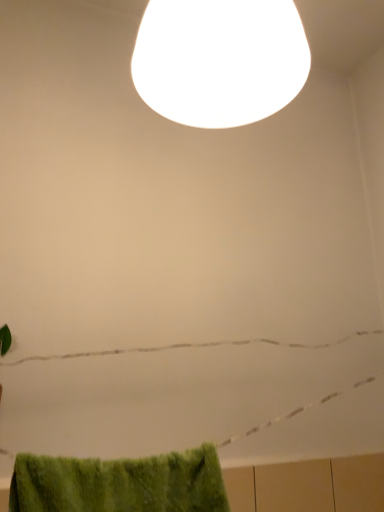
Question: Would you say green fuzzy bath towel at lower left is to the left or to the right of white glossy lampshade at upper center in the picture?

Choices:
 (A) right
 (B) left

Answer: (B)

Question: Is green fuzzy bath towel at lower left spatially inside white glossy lampshade at upper center, or outside of it?

Choices:
 (A) inside
 (B) outside

Answer: (B)

Question: From their relative heights in the image, would you say green fuzzy bath towel at lower left is taller or shorter than white glossy lampshade at upper center?

Choices:
 (A) tall
 (B) short

Answer: (B)

Question: Looking at their shapes, would you say white glossy lampshade at upper center is wider or thinner than green fuzzy bath towel at lower left?

Choices:
 (A) wide
 (B) thin

Answer: (A)

Question: In terms of height, does white glossy lampshade at upper center look taller or shorter compared to green fuzzy bath towel at lower left?

Choices:
 (A) short
 (B) tall

Answer: (B)

Question: Is point (x=221, y=114) positioned closer to the camera than point (x=109, y=471)?

Choices:
 (A) farther
 (B) closer

Answer: (A)

Question: In the image, is white glossy lampshade at upper center on the left side or the right side of green fuzzy bath towel at lower left?

Choices:
 (A) left
 (B) right

Answer: (B)